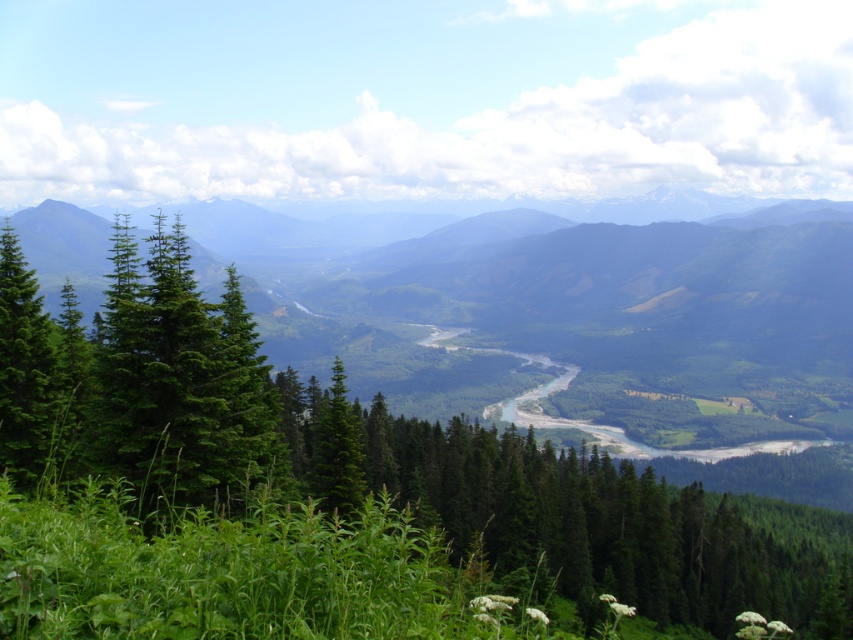
Question: Can you confirm if green evergreen tree at center is thinner than green matte tree at left?

Choices:
 (A) no
 (B) yes

Answer: (A)

Question: Is green evergreen tree at center positioned behind green matte tree at left?

Choices:
 (A) yes
 (B) no

Answer: (B)

Question: Which point is closer to the camera taking this photo?

Choices:
 (A) (32, 330)
 (B) (59, 636)

Answer: (B)

Question: Which object appears farthest from the camera in this image?

Choices:
 (A) green matte tree at left
 (B) green evergreen tree at center

Answer: (A)

Question: Is green evergreen tree at center below green matte tree at left?

Choices:
 (A) yes
 (B) no

Answer: (A)